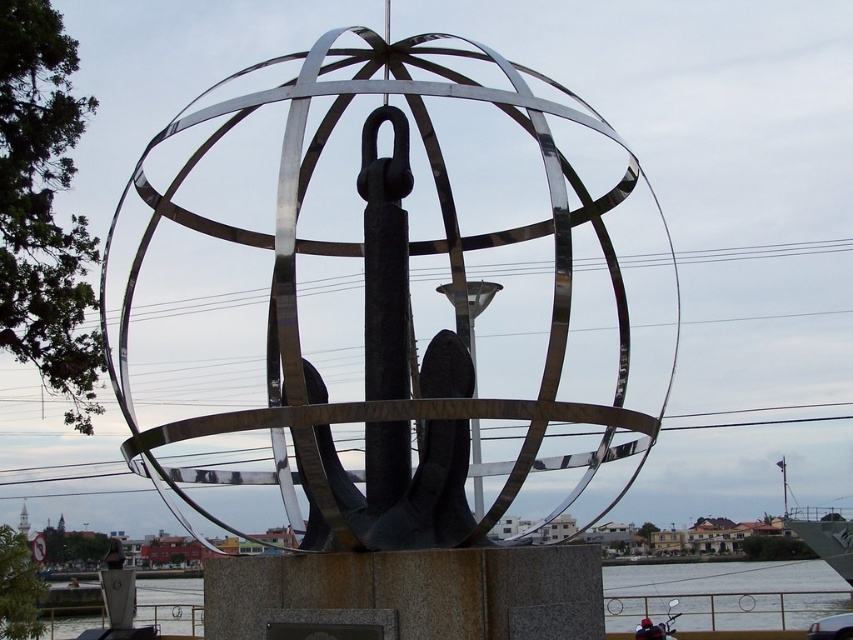
Based on the photo, you are an artist planning to create a miniature model of this sculpture. The transparent water at lower center in the original image takes up 20 square feet. How much space should the polished metal sphere at center occupy in your model to maintain the same proportions?

Since the polished metal sphere at center occupies less space than the transparent water at lower center in the original image, the sphere should take up less than 20 square feet in the model to maintain the same proportions.

You are an artist planning to paint this sculpture. You need to ensure the proportions between the polished metal sphere at center and the transparent water at lower center are accurate. Based on the scene, which object has a smaller width?

The polished metal sphere at center has a lesser width compared to the transparent water at lower center, so the polished metal sphere at center is the smaller one in width.